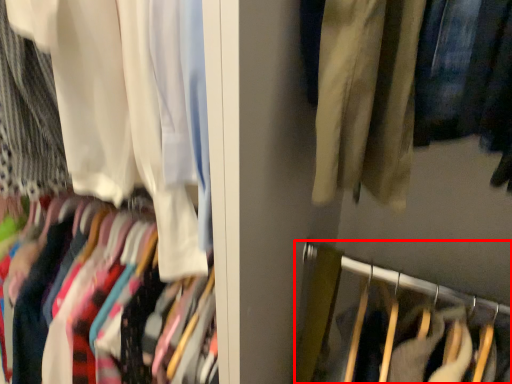
Question: From the image's perspective, where is closet (annotated by the red box) located relative to curtain?

Choices:
 (A) above
 (B) below

Answer: (B)